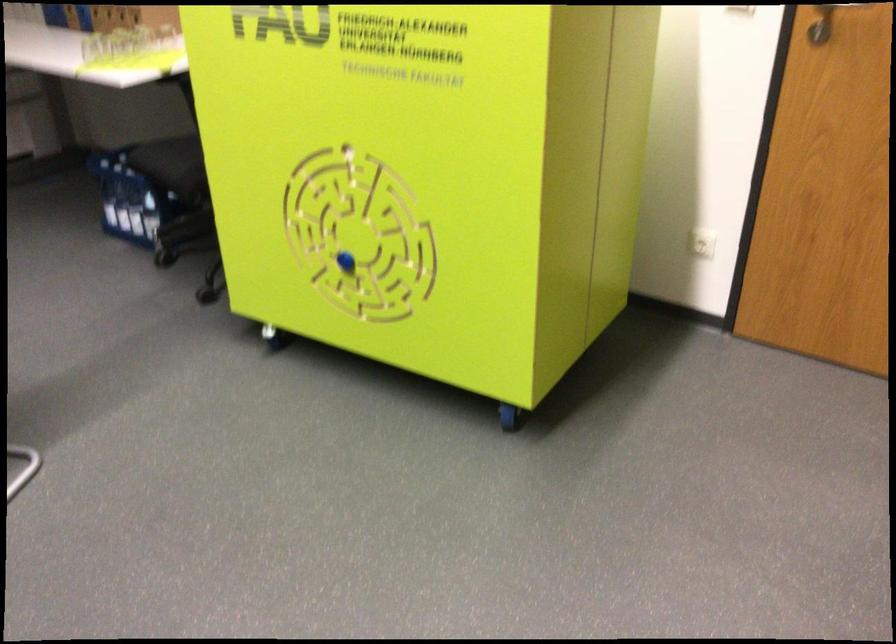
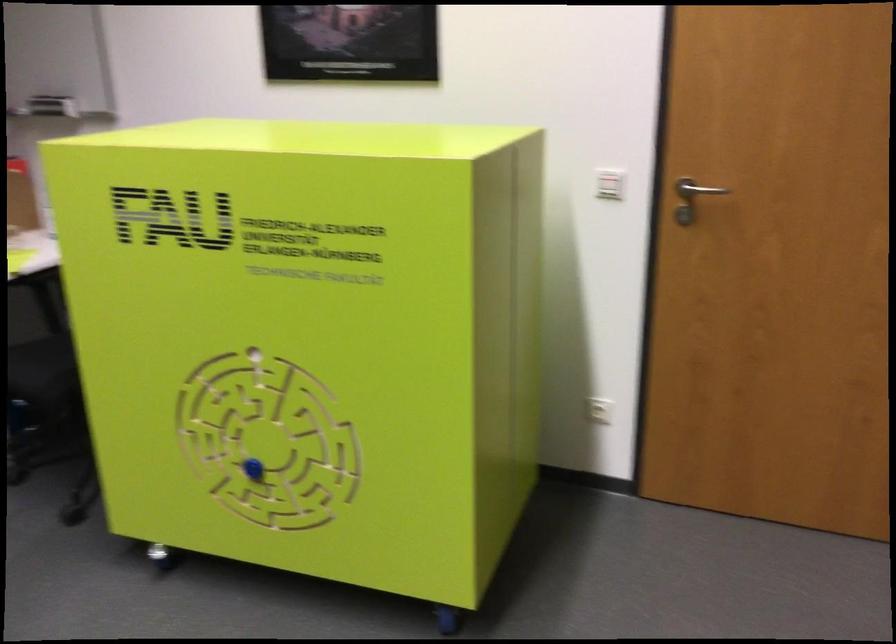
Question: The camera is either moving clockwise (left) or counter-clockwise (right) around the object. The first image is from the beginning of the video and the second image is from the end. Is the camera moving left or right when shooting the video?

Choices:
 (A) Left
 (B) Right

Answer: (A)